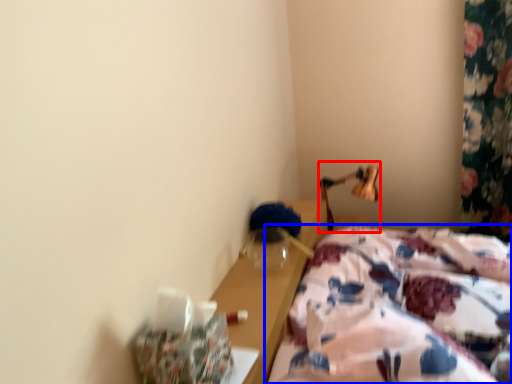
Question: Among these objects, which one is nearest to the camera, bedside lamp (highlighted by a red box) or bed (highlighted by a blue box)?

Choices:
 (A) bedside lamp
 (B) bed

Answer: (B)